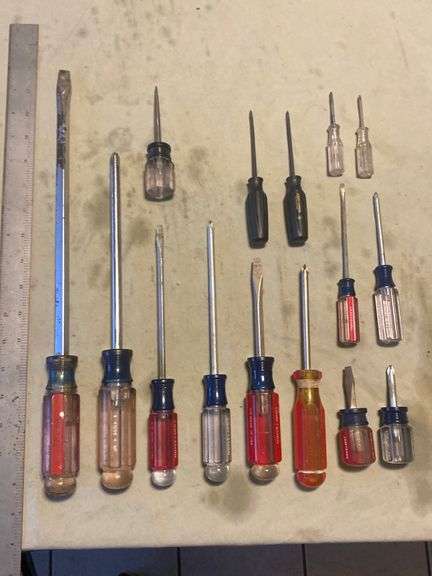
Identify the location of floor board. (41, 559), (110, 560), (238, 556), (373, 544), (429, 550).